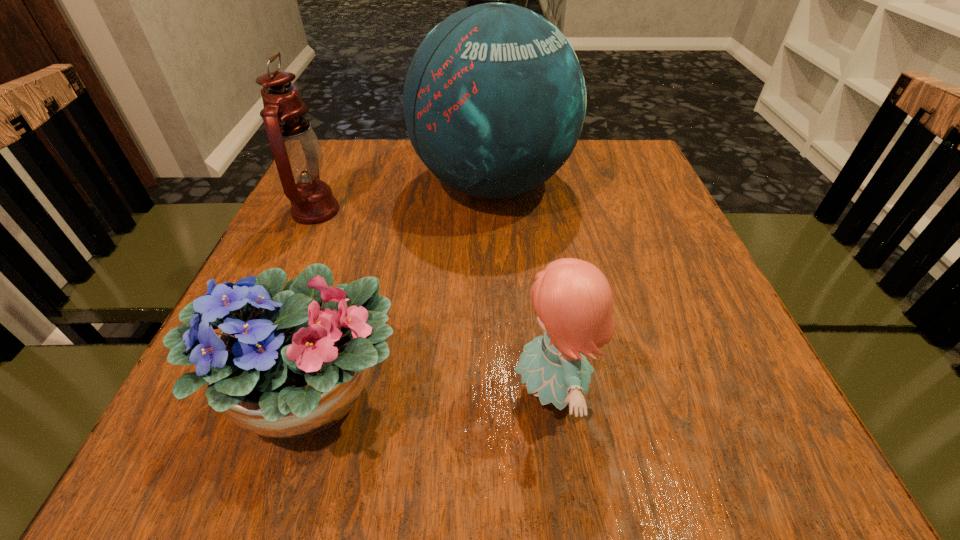
In the image, there is a desktop. At what (x,y) coordinates should I click in order to perform the action: click on vacant space at the near right corner. Please return your answer as a coordinate pair (x, y). The image size is (960, 540). Looking at the image, I should click on (785, 440).

Identify the location of blank region between the doll and the shortest object. (431, 393).

The image size is (960, 540). I want to click on unoccupied position between the doll and the shortest object, so click(431, 393).

This screenshot has height=540, width=960. I want to click on unoccupied position between the doll and the bouquet, so click(431, 393).

You are a GUI agent. You are given a task and a screenshot of the screen. Output one action in this format:
    pyautogui.click(x=<x>, y=<y>)
    Task: Click on the vacant space in between the third shortest object and the globe
    The height and width of the screenshot is (540, 960).
    Given the screenshot: What is the action you would take?
    pyautogui.click(x=404, y=198)

Identify the location of unoccupied position between the doll and the oil lamp. The height and width of the screenshot is (540, 960). pyautogui.click(x=434, y=301).

You are a GUI agent. You are given a task and a screenshot of the screen. Output one action in this format:
    pyautogui.click(x=<x>, y=<y>)
    Task: Click on the vacant space in between the doll and the third shortest object
    This screenshot has width=960, height=540.
    Given the screenshot: What is the action you would take?
    pyautogui.click(x=434, y=301)

Locate an element on the screen. vacant region between the third shortest object and the globe is located at coordinates (404, 198).

I want to click on free area in between the bouquet and the globe, so click(x=401, y=290).

Locate an element on the screen. This screenshot has height=540, width=960. unoccupied area between the doll and the oil lamp is located at coordinates (434, 301).